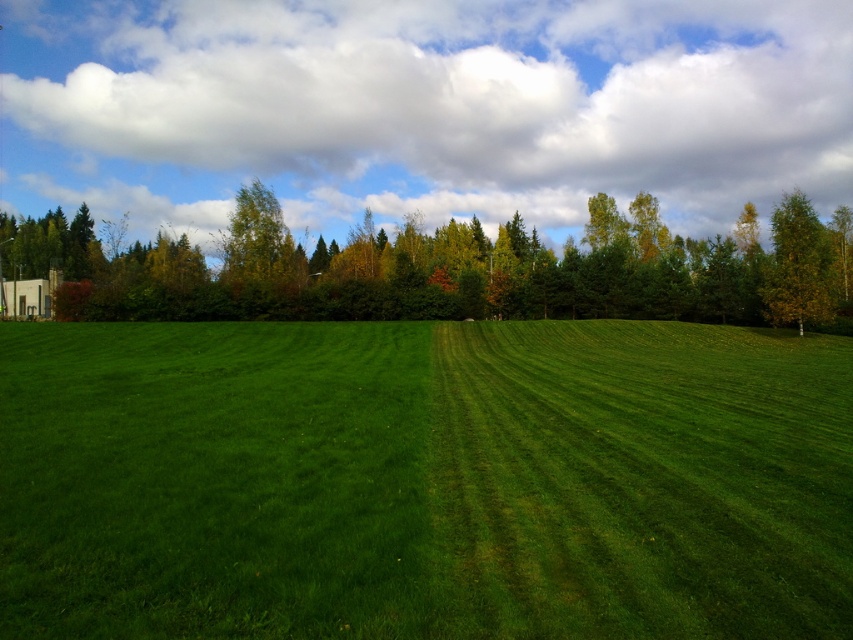
Question: Among these objects, which one is nearest to the camera?

Choices:
 (A) yellow-green leafy tree at right
 (B) green grass at center

Answer: (B)

Question: Does green grass at center have a lesser width compared to yellow-green leafy tree at right?

Choices:
 (A) yes
 (B) no

Answer: (A)

Question: In this image, where is green leafy tree at center located relative to yellow-green leafy tree at right?

Choices:
 (A) below
 (B) above

Answer: (A)

Question: Which point is farther to the camera?

Choices:
 (A) yellow-green leafy tree at right
 (B) green grass at center

Answer: (A)

Question: Considering the relative positions of green grass at center and yellow-green leafy tree at right in the image provided, where is green grass at center located with respect to yellow-green leafy tree at right?

Choices:
 (A) below
 (B) above

Answer: (A)

Question: Which point is closer to the camera taking this photo?

Choices:
 (A) (822, 246)
 (B) (363, 248)

Answer: (A)